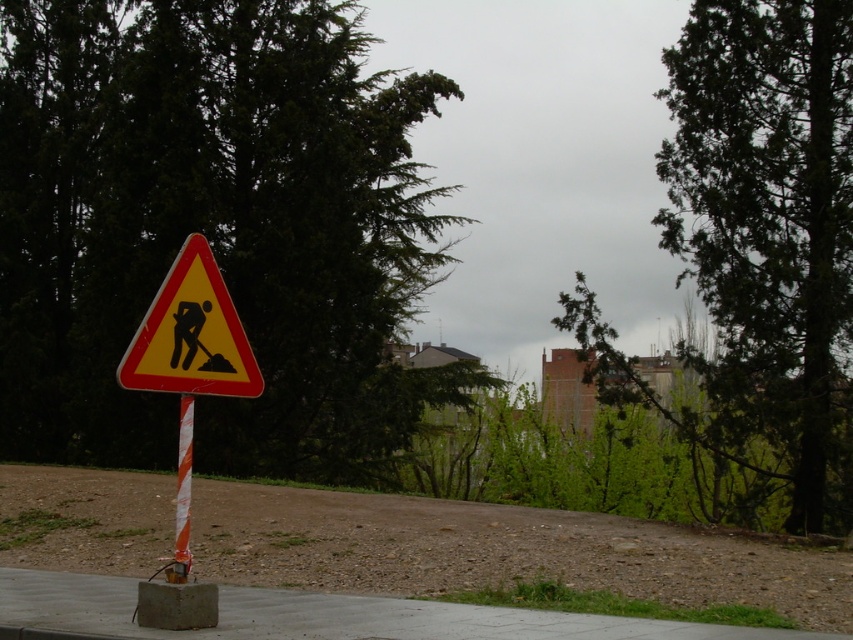
You are standing at the point marked by coordinates point [325,616] in the image. Based on the scene description, what material are you most likely standing on?

You are most likely standing on concrete at center, as the point [325,616] indicates concrete at center.

You are a pedestrian walking towards the concrete at center and the green leafy tree at upper right. Which object will you encounter first?

You will encounter the green leafy tree at upper right first because it is closer to you than the concrete at center, which is further away.